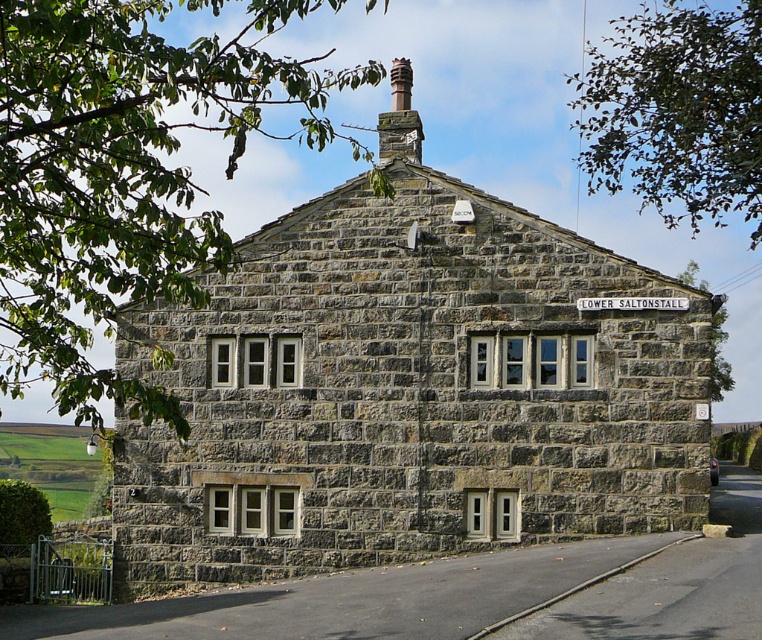
You are standing in front of the stone cottage at center and want to locate the smooth stone chimney at upper center. Based on the scene, which direction should you turn your head to see it?

The stone cottage at center is to the left of smooth stone chimney at upper center, so you should turn your head to the right to see it.

You are standing at a distance from the stone cottage at center. If you want to take a photo of it with your camera, will you need to zoom in or out to capture the entire cottage in the frame?

The stone cottage at center and camera are 61.66 meters apart. To capture the entire cottage in the frame from that distance, you would likely need to zoom out to ensure the entire structure fits within the camera view.